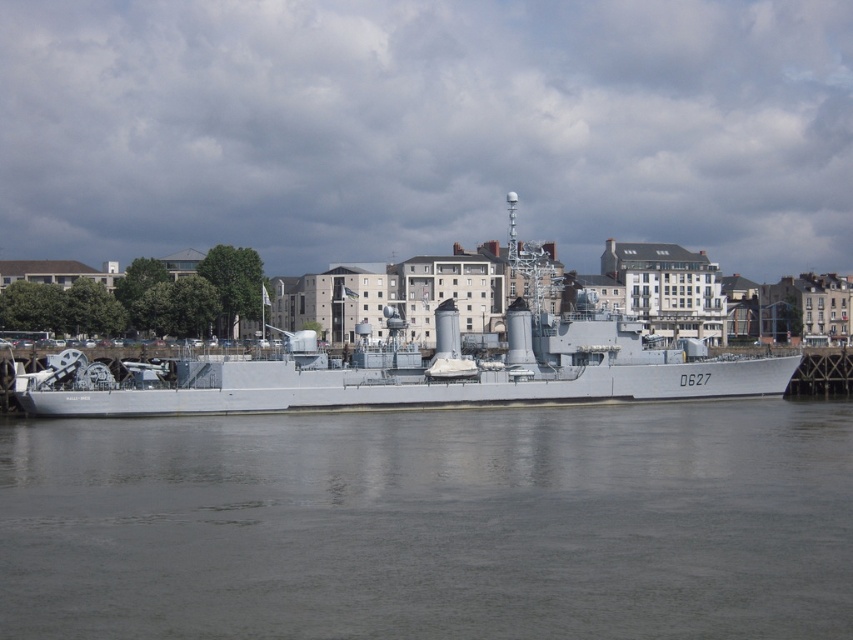
You are standing on the waterfront and see the gray smooth water at center and the white metallic ship at center. Which object is located below the other?

The gray smooth water at center is positioned under the white metallic ship at center, so the water is below the ship.

You are a photographer trying to capture the white metallic ship at center from the waterfront. Since you want the ship to appear wider in the photo than the gray smooth water at center, which object should you focus on zooming in on?

You should zoom in on the white metallic ship at center because the gray smooth water at center has a lesser width compared to the white metallic ship at center, so focusing on the ship will make it appear wider in the photo.

You are standing on the waterfront and see the gray smooth water at center and the white metallic ship at center. Which object is positioned to the right of the other?

The gray smooth water at center is to the right of the white metallic ship at center.